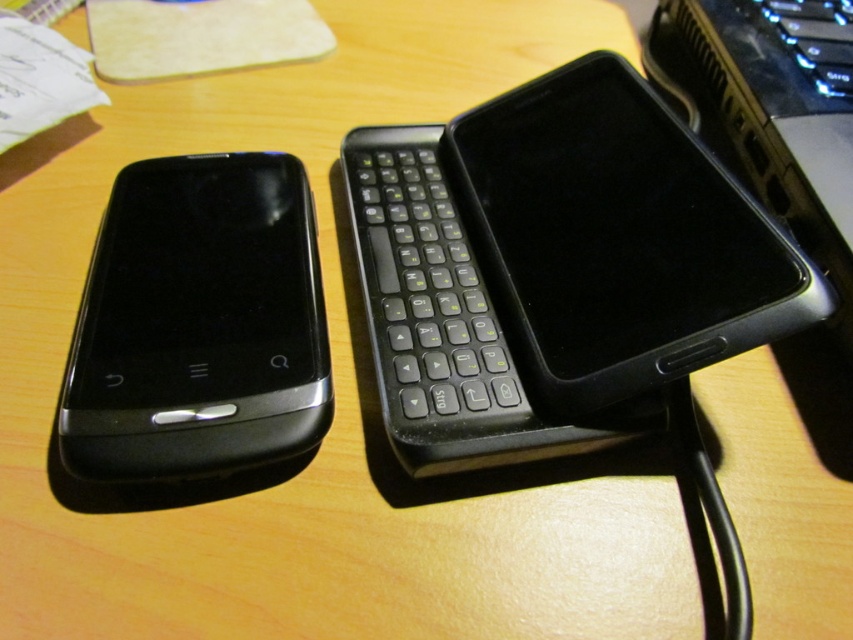
Question: Which point is farther from the camera taking this photo?

Choices:
 (A) (202, 356)
 (B) (463, 280)
 (C) (758, 273)

Answer: (B)

Question: Considering the real-world distances, which object is farthest from the black plastic keyboard at center?

Choices:
 (A) black matte smartphone at center
 (B) black glossy smartphone at left

Answer: (B)

Question: Considering the relative positions of black matte smartphone at center and black glossy smartphone at left in the image provided, where is black matte smartphone at center located with respect to black glossy smartphone at left?

Choices:
 (A) right
 (B) left

Answer: (A)

Question: From the image, what is the correct spatial relationship of black matte smartphone at center in relation to black plastic keyboard at center?

Choices:
 (A) left
 (B) right

Answer: (B)

Question: Can you confirm if black glossy smartphone at left is smaller than black plastic keyboard at center?

Choices:
 (A) yes
 (B) no

Answer: (A)

Question: Which is nearer to the black plastic keyboard at center?

Choices:
 (A) black glossy smartphone at left
 (B) black matte smartphone at center

Answer: (B)